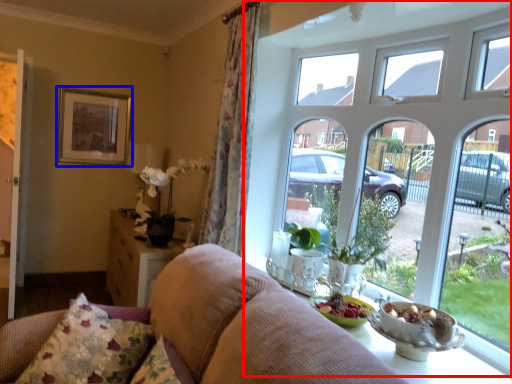
Question: Which point is further to the camera, window (highlighted by a red box) or picture frame (highlighted by a blue box)?

Choices:
 (A) window
 (B) picture frame

Answer: (B)